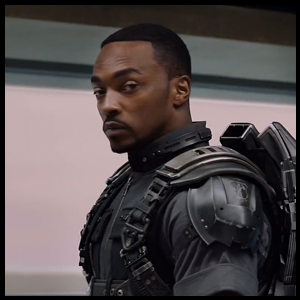
You are a GUI agent. You are given a task and a screenshot of the screen. Output one action in this format:
    pyautogui.click(x=<x>, y=<y>)
    Task: Click on the black ceiling
    The width and height of the screenshot is (300, 300).
    Given the screenshot: What is the action you would take?
    pyautogui.click(x=280, y=5)